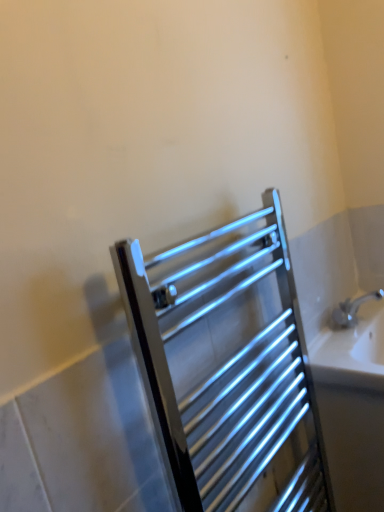
Question: Is the position of white glossy sink at lower right less distant than that of chrome metallic towel rack at center?

Choices:
 (A) no
 (B) yes

Answer: (A)

Question: From a real-world perspective, is white glossy sink at lower right on chrome metallic towel rack at center?

Choices:
 (A) no
 (B) yes

Answer: (A)

Question: Does white glossy sink at lower right have a smaller size compared to chrome metallic towel rack at center?

Choices:
 (A) yes
 (B) no

Answer: (B)

Question: Is white glossy sink at lower right taller than chrome metallic towel rack at center?

Choices:
 (A) no
 (B) yes

Answer: (A)

Question: Can you confirm if white glossy sink at lower right is thinner than chrome metallic towel rack at center?

Choices:
 (A) no
 (B) yes

Answer: (A)

Question: From the image's perspective, is white glossy sink at lower right beneath chrome metallic towel rack at center?

Choices:
 (A) no
 (B) yes

Answer: (B)

Question: Is chrome metallic towel rack at center to the right of white glossy sink at lower right from the viewer's perspective?

Choices:
 (A) yes
 (B) no

Answer: (B)

Question: Does chrome metallic towel rack at center have a greater height compared to white glossy sink at lower right?

Choices:
 (A) no
 (B) yes

Answer: (B)

Question: Can you confirm if chrome metallic towel rack at center is thinner than white glossy sink at lower right?

Choices:
 (A) no
 (B) yes

Answer: (B)

Question: Is chrome metallic towel rack at center closer to the viewer compared to white glossy sink at lower right?

Choices:
 (A) yes
 (B) no

Answer: (A)

Question: Is chrome metallic towel rack at center aimed at white glossy sink at lower right?

Choices:
 (A) no
 (B) yes

Answer: (A)

Question: From a real-world perspective, is chrome metallic towel rack at center positioned under white glossy sink at lower right based on gravity?

Choices:
 (A) no
 (B) yes

Answer: (A)

Question: From the image's perspective, is white glossy sink at lower right above or below chrome metallic towel rack at center?

Choices:
 (A) below
 (B) above

Answer: (A)